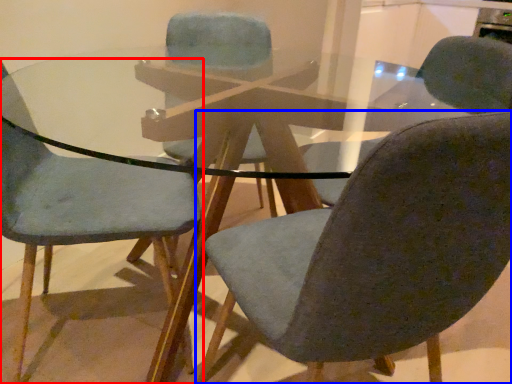
Question: Which point is closer to the camera, chair (highlighted by a red box) or chair (highlighted by a blue box)?

Choices:
 (A) chair
 (B) chair

Answer: (B)